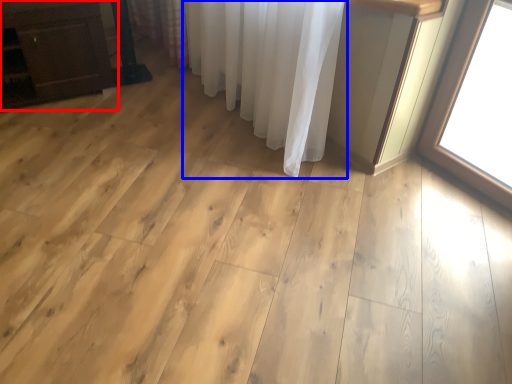
Question: Which object is closer to the camera taking this photo, furniture (highlighted by a red box) or curtain (highlighted by a blue box)?

Choices:
 (A) furniture
 (B) curtain

Answer: (B)